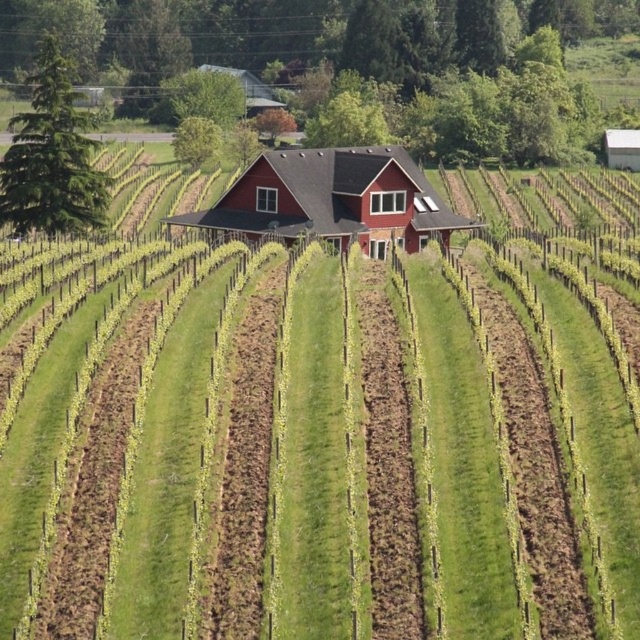
Question: Is matte red barn at center to the right of white corrugated metal barn at upper right from the viewer's perspective?

Choices:
 (A) yes
 (B) no

Answer: (B)

Question: Which object appears closest to the camera in this image?

Choices:
 (A) white corrugated metal barn at upper right
 (B) matte red barn at center

Answer: (B)

Question: From the image, what is the correct spatial relationship of matte red barn at center in relation to white corrugated metal barn at upper right?

Choices:
 (A) left
 (B) right

Answer: (A)

Question: Can you confirm if matte red barn at center is positioned to the right of white corrugated metal barn at upper right?

Choices:
 (A) yes
 (B) no

Answer: (B)